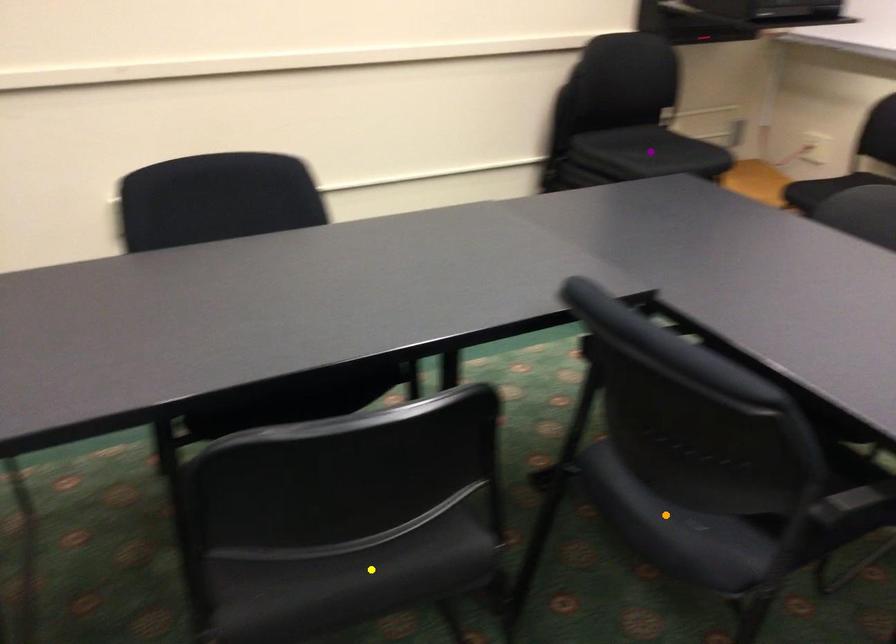
Order these from nearest to farthest:
- purple point
- yellow point
- orange point

yellow point
orange point
purple point